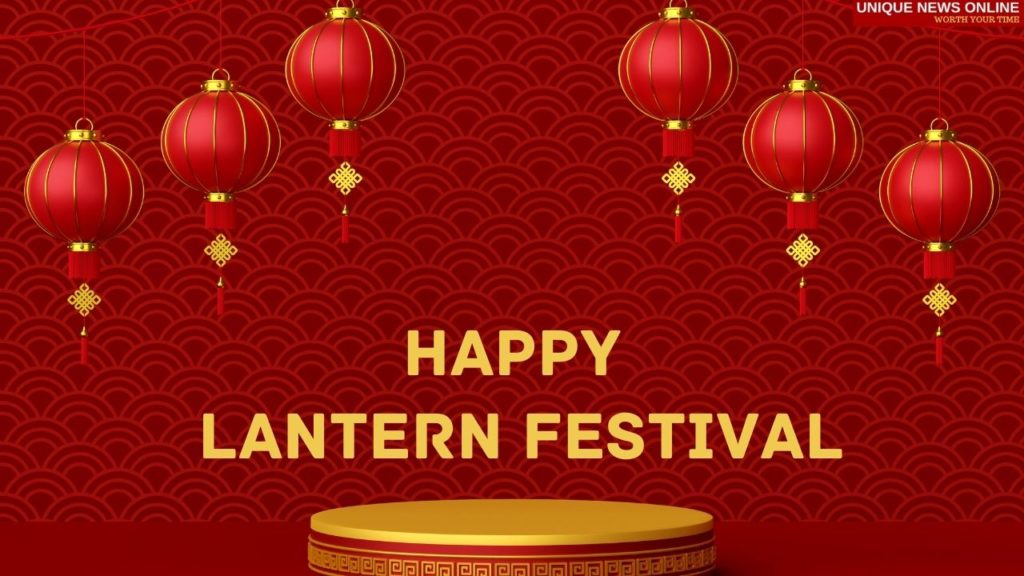
Locate an element on the screen. Image resolution: width=1024 pixels, height=576 pixels. lantern is located at coordinates (911, 204), (765, 120), (695, 58), (376, 72), (228, 142), (121, 179).